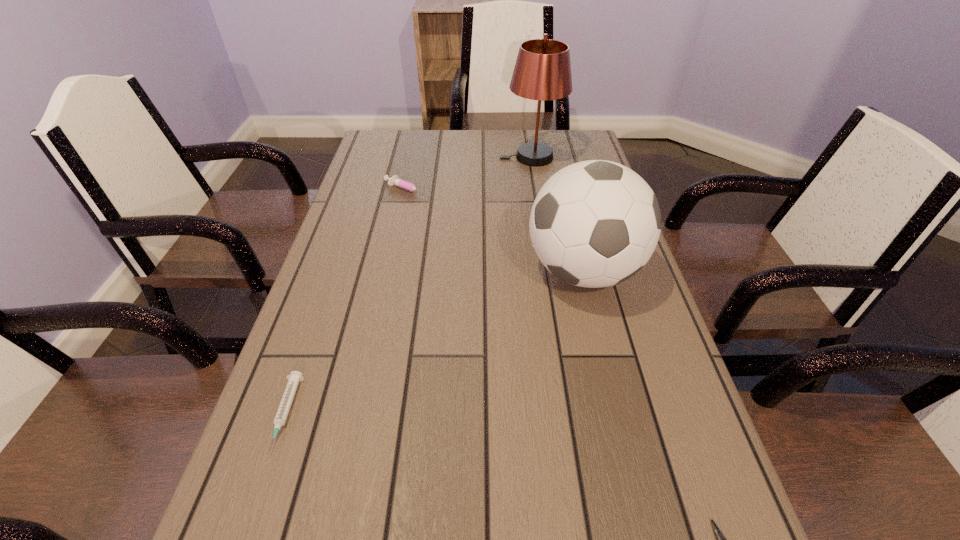
In the image, there is a desktop. What are the coordinates of `blank space at the right edge` in the screenshot? It's located at (684, 523).

You are a GUI agent. You are given a task and a screenshot of the screen. Output one action in this format:
    pyautogui.click(x=<x>, y=<y>)
    Task: Click on the empty location between the left syringe and the lampshade
    
    Given the screenshot: What is the action you would take?
    pyautogui.click(x=408, y=286)

Where is `free point between the left syringe and the second farthest object`? The image size is (960, 540). free point between the left syringe and the second farthest object is located at coordinates (347, 302).

Locate an element on the screen. vacant space in between the fourth farthest object and the third farthest object is located at coordinates (434, 343).

You are a GUI agent. You are given a task and a screenshot of the screen. Output one action in this format:
    pyautogui.click(x=<x>, y=<y>)
    Task: Click on the free space between the taller syringe and the third nearest object
    
    Given the screenshot: What is the action you would take?
    pyautogui.click(x=495, y=231)

You are a GUI agent. You are given a task and a screenshot of the screen. Output one action in this format:
    pyautogui.click(x=<x>, y=<y>)
    Task: Click on the free point between the right syringe and the tallest object
    The height and width of the screenshot is (540, 960).
    Given the screenshot: What is the action you would take?
    pyautogui.click(x=469, y=173)

Locate an element on the screen. The height and width of the screenshot is (540, 960). unoccupied area between the fourth object from right to left and the fourth shortest object is located at coordinates (495, 231).

Identify the location of object that stands as the third closest to the left syringe. Image resolution: width=960 pixels, height=540 pixels. (721, 539).

What are the coordinates of `object that is the closest to the soccer ball` in the screenshot? It's located at (394, 180).

This screenshot has height=540, width=960. What are the coordinates of `vacant space that satisfies the following two spatial constraints: 1. on the front-facing side of the soccer ball; 2. on the left side of the tallest object` in the screenshot? It's located at (550, 271).